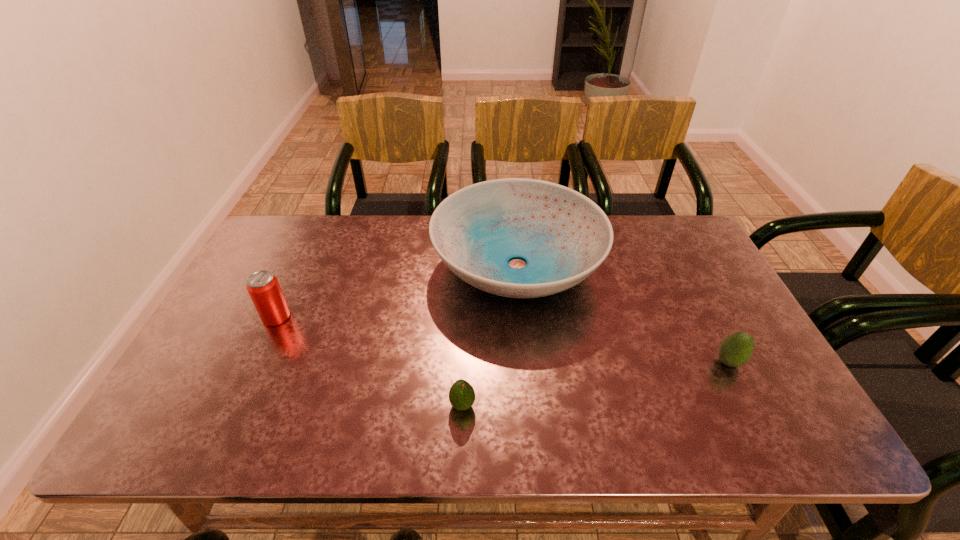
Where is `vacant area that lies between the can and the dish`? The width and height of the screenshot is (960, 540). vacant area that lies between the can and the dish is located at coordinates (396, 291).

The width and height of the screenshot is (960, 540). In order to click on free space between the right avocado and the can in this screenshot , I will do `click(502, 339)`.

This screenshot has height=540, width=960. I want to click on vacant area that lies between the nearer avocado and the dish, so click(x=490, y=335).

Locate an element on the screen. vacant area that lies between the can and the dish is located at coordinates (396, 291).

Where is `vacant space that is in between the right avocado and the shorter avocado`? vacant space that is in between the right avocado and the shorter avocado is located at coordinates (595, 383).

The image size is (960, 540). I want to click on vacant space in between the leftmost object and the dish, so click(x=396, y=291).

This screenshot has height=540, width=960. Identify the location of free spot between the dish and the leftmost object. (396, 291).

This screenshot has width=960, height=540. I want to click on unoccupied position between the dish and the can, so click(x=396, y=291).

Where is `free space between the third tallest object and the left avocado`? This screenshot has width=960, height=540. free space between the third tallest object and the left avocado is located at coordinates coord(595,383).

Locate an element on the screen. The width and height of the screenshot is (960, 540). free space between the dish and the left avocado is located at coordinates (490, 335).